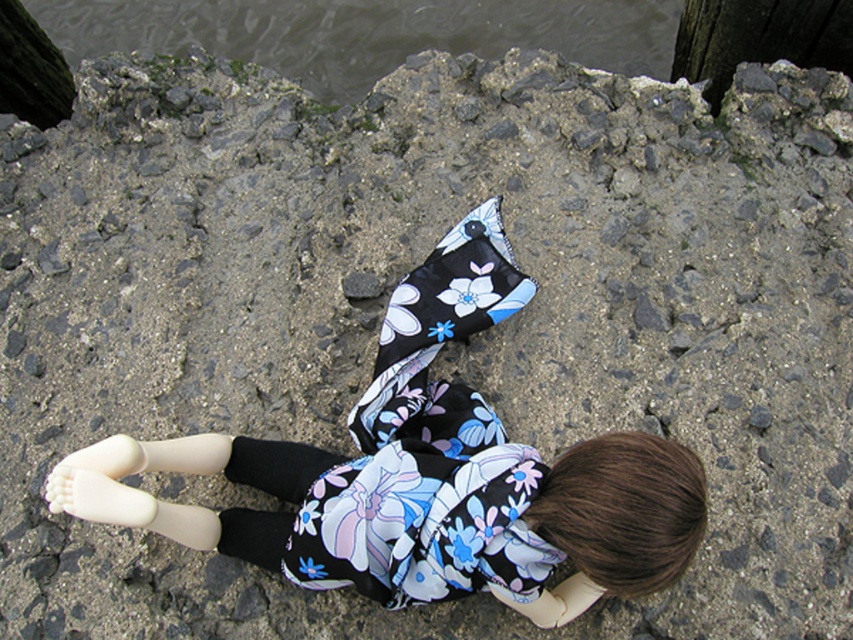
Question: Which object appears farthest from the camera in this image?

Choices:
 (A) clear water at upper center
 (B) floral fabric doll at center

Answer: (A)

Question: Is floral fabric doll at center positioned in front of clear water at upper center?

Choices:
 (A) no
 (B) yes

Answer: (B)

Question: Is floral fabric doll at center positioned in front of clear water at upper center?

Choices:
 (A) no
 (B) yes

Answer: (B)

Question: Which point is closer to the camera?

Choices:
 (A) (318, 472)
 (B) (329, 49)

Answer: (A)

Question: From the image, what is the correct spatial relationship of floral fabric doll at center in relation to clear water at upper center?

Choices:
 (A) right
 (B) left

Answer: (A)